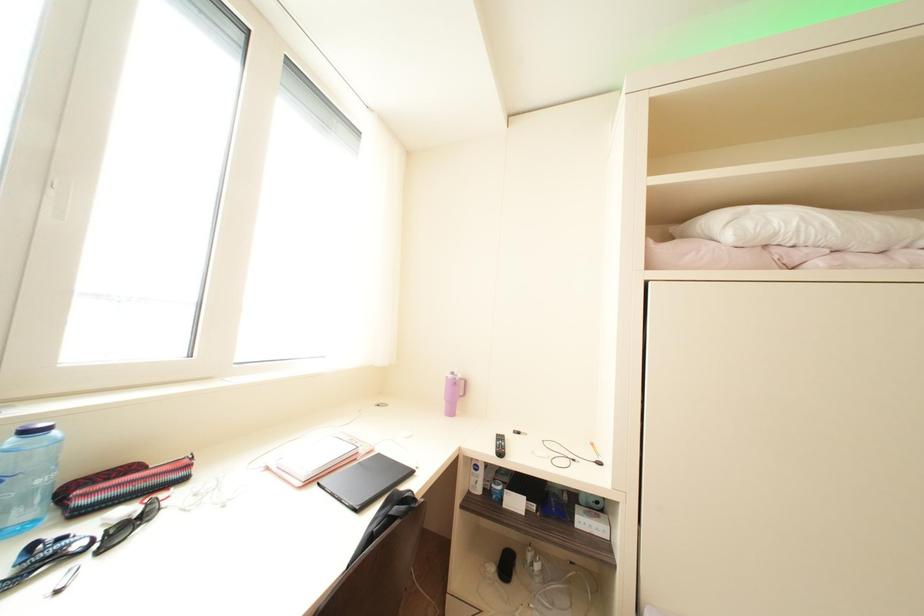
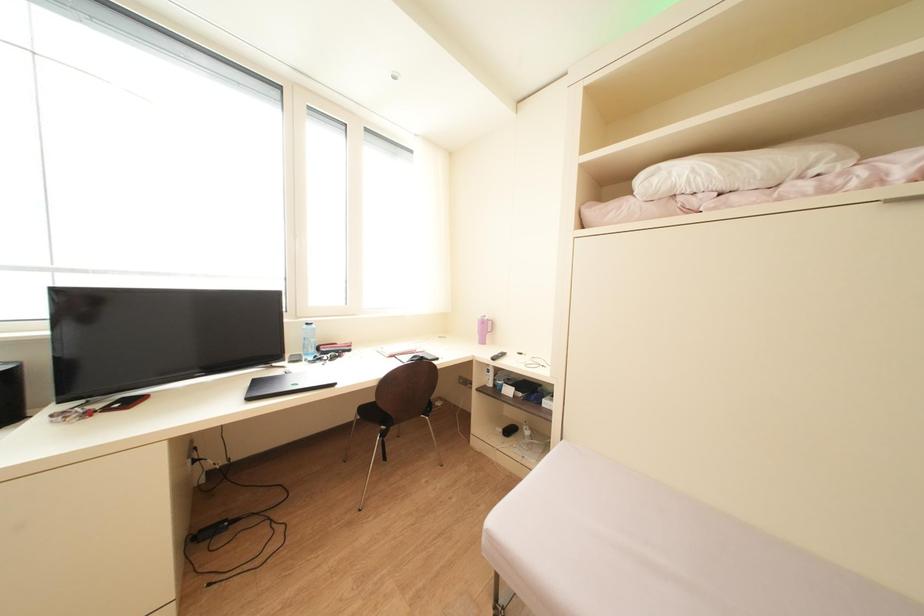
Question: The camera is either moving clockwise (left) or counter-clockwise (right) around the object. The first image is from the beginning of the video and the second image is from the end. Is the camera moving left or right when shooting the video?

Choices:
 (A) Left
 (B) Right

Answer: (B)